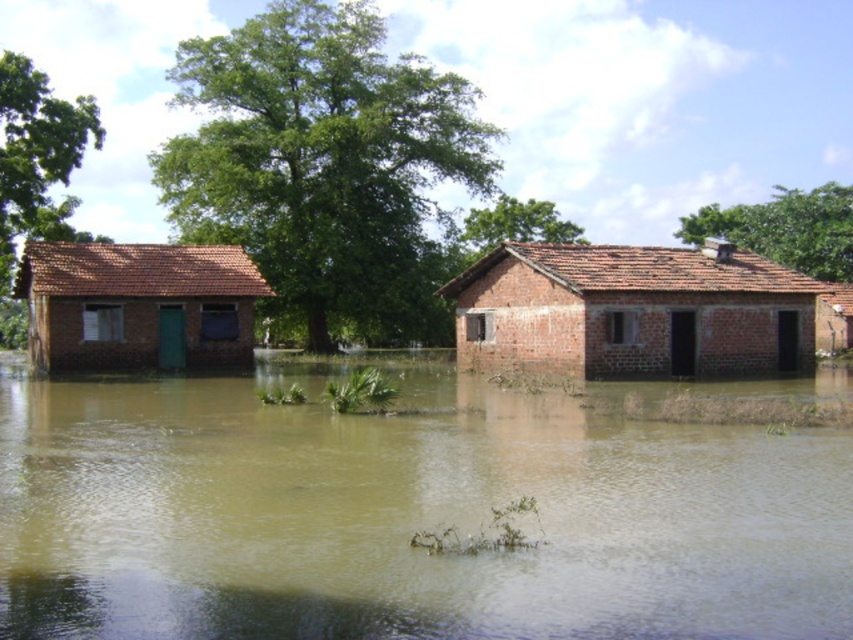
Question: Is brown muddy water at center positioned behind brick house at right?

Choices:
 (A) yes
 (B) no

Answer: (B)

Question: Estimate the real-world distances between objects in this image. Which object is farther from the matte brick house at left?

Choices:
 (A) brown muddy water at center
 (B) brick house at right

Answer: (B)

Question: Among these objects, which one is farthest from the camera?

Choices:
 (A) brown muddy water at center
 (B) matte brick house at left

Answer: (B)

Question: Which point is closer to the camera?

Choices:
 (A) (30, 353)
 (B) (683, 433)

Answer: (B)

Question: Can you confirm if brick house at right is thinner than matte brick house at left?

Choices:
 (A) no
 (B) yes

Answer: (A)

Question: Can you confirm if brown muddy water at center is thinner than matte brick house at left?

Choices:
 (A) yes
 (B) no

Answer: (B)